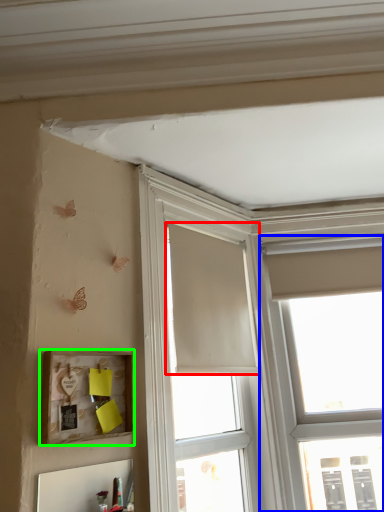
Question: Based on their relative distances, which object is farther from curtain (highlighted by a red box)? Choose from window (highlighted by a blue box) and picture frame (highlighted by a green box).

Choices:
 (A) window
 (B) picture frame

Answer: (B)